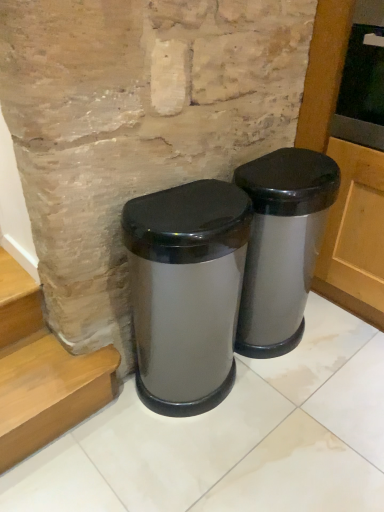
Question: Which direction should I rotate to face satin silver trash can at center, which is the 2th waste container in left-to-right order, — up or down?

Choices:
 (A) up
 (B) down

Answer: (B)

Question: Is satin silver trash can at center, arranged as the second waste container when viewed from the right, not within satin silver trash can at center, the 1th waste container positioned from the right?

Choices:
 (A) yes
 (B) no

Answer: (A)

Question: Does satin silver trash can at center, arranged as the second waste container when viewed from the right, appear on the right side of satin silver trash can at center, which is the 2th waste container in left-to-right order?

Choices:
 (A) yes
 (B) no

Answer: (B)

Question: Is satin silver trash can at center, which is the 1th waste container in left-to-right order, directly adjacent to satin silver trash can at center, which is the 2th waste container in left-to-right order?

Choices:
 (A) yes
 (B) no

Answer: (B)

Question: Does satin silver trash can at center, arranged as the second waste container when viewed from the right, have a larger size compared to satin silver trash can at center, the 1th waste container positioned from the right?

Choices:
 (A) yes
 (B) no

Answer: (B)

Question: Can you confirm if satin silver trash can at center, which is the 1th waste container in left-to-right order, is thinner than satin silver trash can at center, which is the 2th waste container in left-to-right order?

Choices:
 (A) no
 (B) yes

Answer: (A)

Question: Considering the relative sizes of satin silver trash can at center, arranged as the second waste container when viewed from the right, and satin silver trash can at center, which is the 2th waste container in left-to-right order, in the image provided, is satin silver trash can at center, arranged as the second waste container when viewed from the right, shorter than satin silver trash can at center, which is the 2th waste container in left-to-right order,?

Choices:
 (A) no
 (B) yes

Answer: (A)

Question: Is satin silver trash can at center, which is the 2th waste container in left-to-right order, behind satin silver trash can at center, which is the 1th waste container in left-to-right order?

Choices:
 (A) no
 (B) yes

Answer: (B)

Question: Is satin silver trash can at center, the 1th waste container positioned from the right, surrounding satin silver trash can at center, which is the 1th waste container in left-to-right order?

Choices:
 (A) yes
 (B) no

Answer: (B)

Question: From the image's perspective, is satin silver trash can at center, which is the 2th waste container in left-to-right order, below satin silver trash can at center, which is the 1th waste container in left-to-right order?

Choices:
 (A) yes
 (B) no

Answer: (B)

Question: Is satin silver trash can at center, the 1th waste container positioned from the right, positioned in front of satin silver trash can at center, which is the 1th waste container in left-to-right order?

Choices:
 (A) no
 (B) yes

Answer: (A)

Question: Considering the relative sizes of satin silver trash can at center, which is the 2th waste container in left-to-right order, and satin silver trash can at center, which is the 1th waste container in left-to-right order, in the image provided, is satin silver trash can at center, which is the 2th waste container in left-to-right order, shorter than satin silver trash can at center, which is the 1th waste container in left-to-right order,?

Choices:
 (A) yes
 (B) no

Answer: (A)

Question: Is satin silver trash can at center, which is the 2th waste container in left-to-right order, aimed at satin silver trash can at center, which is the 1th waste container in left-to-right order?

Choices:
 (A) yes
 (B) no

Answer: (B)

Question: Looking at the image, does satin silver trash can at center, which is the 1th waste container in left-to-right order, seem bigger or smaller compared to satin silver trash can at center, the 1th waste container positioned from the right?

Choices:
 (A) big
 (B) small

Answer: (B)